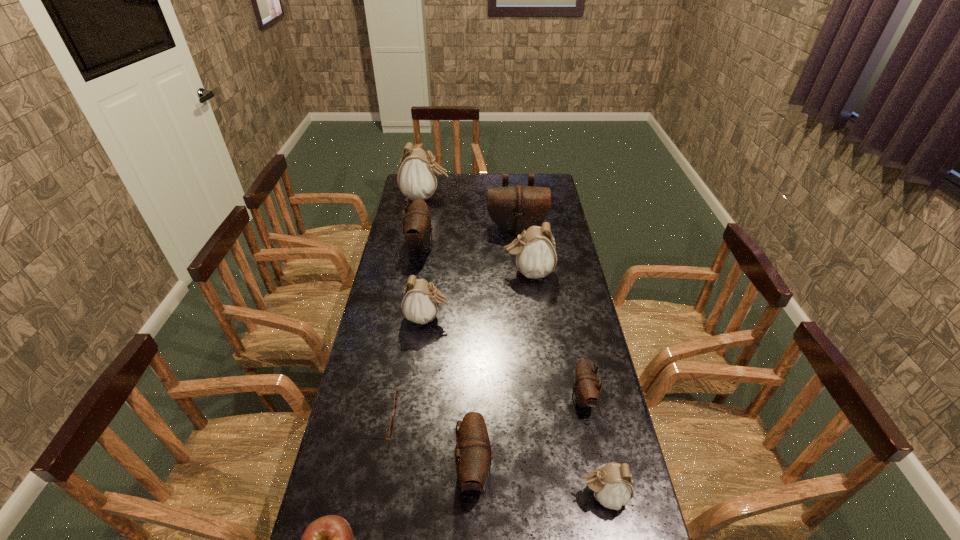
Identify which pouch is located as the third nearest to the fourth nearest pouch. Please provide its 2D coordinates. Your answer should be formatted as a tuple, i.e. [(x, y)], where the tuple contains the x and y coordinates of a point satisfying the conditions above.

[(473, 455)]

Select which pouch appears as the third closest to the second farthest white pouch. Please provide its 2D coordinates. Your answer should be formatted as a tuple, i.e. [(x, y)], where the tuple contains the x and y coordinates of a point satisfying the conditions above.

[(417, 227)]

Identify which white pouch is the third closest to the sunglasses. Please provide its 2D coordinates. Your answer should be formatted as a tuple, i.e. [(x, y)], where the tuple contains the x and y coordinates of a point satisfying the conditions above.

[(535, 251)]

At what (x,y) coordinates should I click in order to perform the action: click on white pouch that is the second closest to the nearest object. Please return your answer as a coordinate pair (x, y). Image resolution: width=960 pixels, height=540 pixels. Looking at the image, I should click on (420, 302).

At what (x,y) coordinates should I click in order to perform the action: click on the third closest brown pouch to the biggest white pouch. Please return your answer as a coordinate pair (x, y). The image size is (960, 540). Looking at the image, I should click on (586, 389).

Locate which brown pouch is the third closest to the third biggest white pouch. Please provide its 2D coordinates. Your answer should be formatted as a tuple, i.e. [(x, y)], where the tuple contains the x and y coordinates of a point satisfying the conditions above.

[(586, 389)]

In order to click on vacant space that satisfies the following two spatial constraints: 1. with the flap open on the biggest brown pouch; 2. on the face of the sunglasses in this screenshot , I will do `click(538, 417)`.